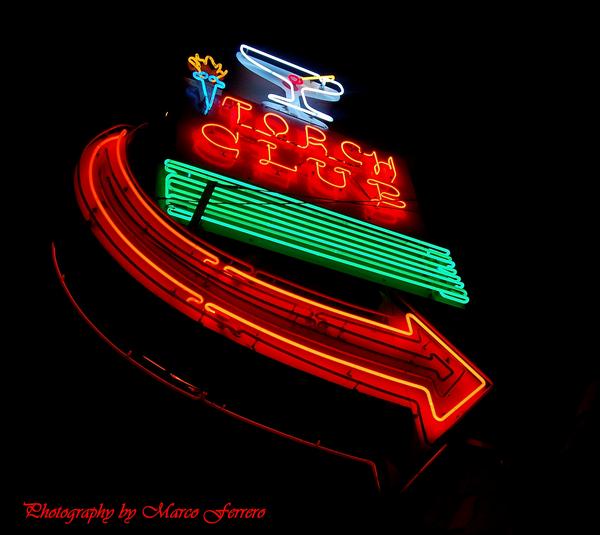
Locate an element on the screen. The image size is (600, 535). martini glass neon is located at coordinates tap(303, 91).